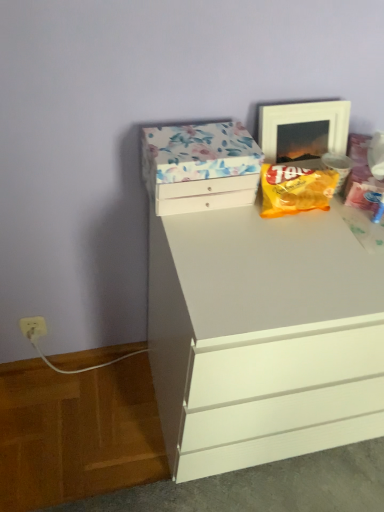
This screenshot has width=384, height=512. Find the location of `free point in front of white glossy picture frame at upper right`. free point in front of white glossy picture frame at upper right is located at coordinates (311, 226).